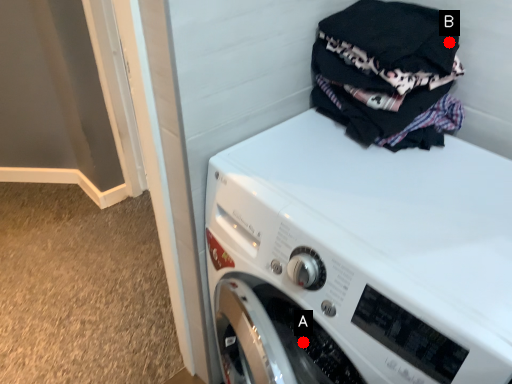
Question: Two points are circled on the image, labeled by A and B beside each circle. Which point is farther to the camera?

Choices:
 (A) A is further
 (B) B is further

Answer: (A)